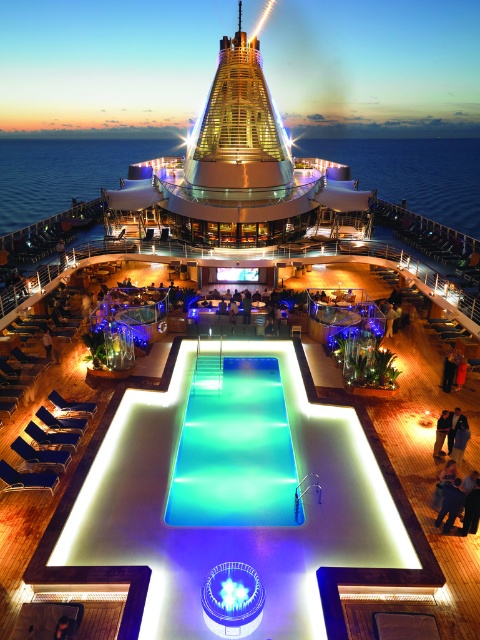
Is blue glossy pool at center above translucent glass pool at center?

No, blue glossy pool at center is not above translucent glass pool at center.

Is point (311, 412) farther from viewer compared to point (276, 413)?

No, (311, 412) is in front of (276, 413).

Where is `blue glossy pool at center`? blue glossy pool at center is located at coordinates (232, 525).

Is blue glossy pool at center further to the viewer compared to shiny metallic cruise ship at upper center?

No, it is in front of shiny metallic cruise ship at upper center.

Is point (316, 627) positioned before point (317, 205)?

Yes, it is.

At what (x,y) coordinates should I click in order to perform the action: click on blue glossy pool at center. Please return your answer as a coordinate pair (x, y). This screenshot has width=480, height=640. Looking at the image, I should click on (232, 525).

Which is more to the left, shiny metallic cruise ship at upper center or translucent glass pool at center?

shiny metallic cruise ship at upper center

Between point (224, 179) and point (194, 465), which one is positioned in front?

Point (194, 465)

Which is behind, point (215, 109) or point (207, 444)?

Positioned behind is point (215, 109).

The width and height of the screenshot is (480, 640). I want to click on shiny metallic cruise ship at upper center, so click(x=236, y=166).